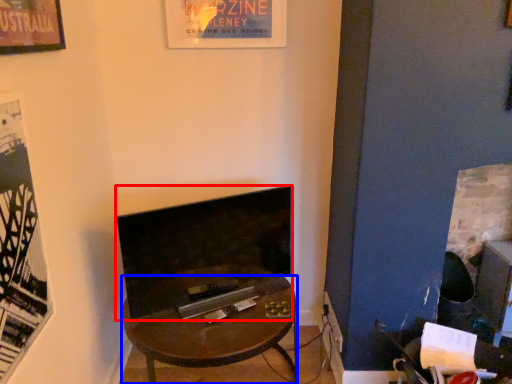
Question: Which of the following is the farthest to the observer, fireplace (highlighted by a red box) or desk (highlighted by a blue box)?

Choices:
 (A) fireplace
 (B) desk

Answer: (A)